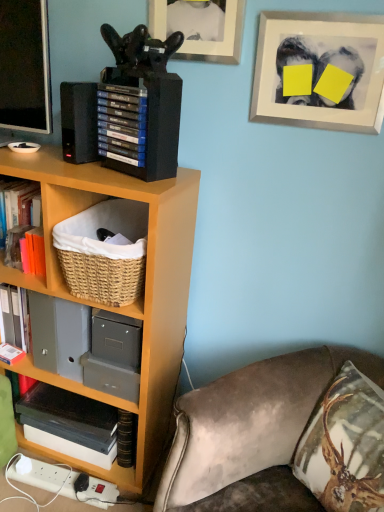
This screenshot has height=512, width=384. In order to click on vacant region above white plastic plug at lower left (from a real-world perspective) in this screenshot , I will do tap(69, 475).